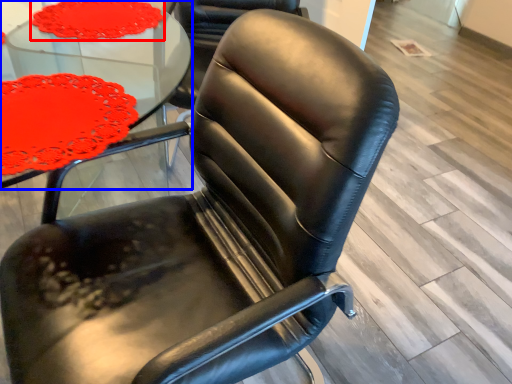
Question: Which object appears farthest to the camera in this image, tablecloth (highlighted by a red box) or table (highlighted by a blue box)?

Choices:
 (A) tablecloth
 (B) table

Answer: (A)